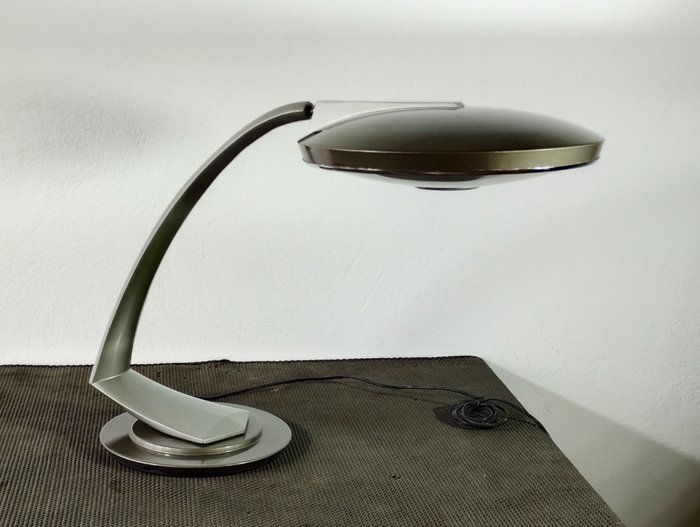
This screenshot has height=527, width=700. Find the location of `lamp`. lamp is located at coordinates (452, 134).